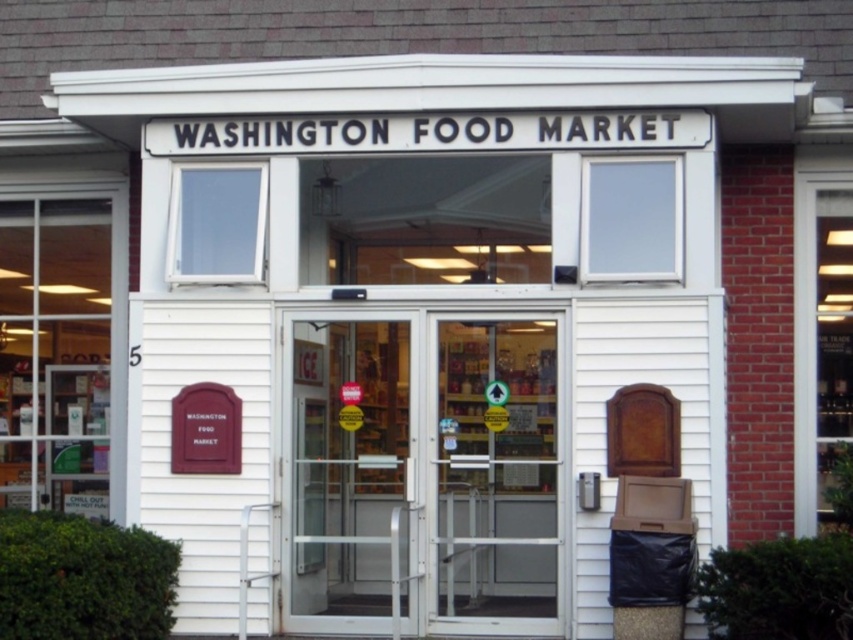
Looking at this image, you are standing at the entrance of Washington Food Market and want to take a photo of both the point at coordinates (312, 321) and the point at (546, 589). Which point will appear larger in your camera view?

Point at coordinates (312, 321) will appear larger in the camera view because it is closer to the camera than point at coordinates (546, 589).